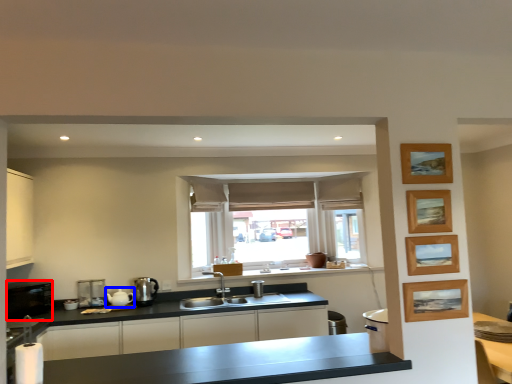
Question: Which point is further to the camera, appliance (highlighted by a red box) or tea pot (highlighted by a blue box)?

Choices:
 (A) appliance
 (B) tea pot

Answer: (B)